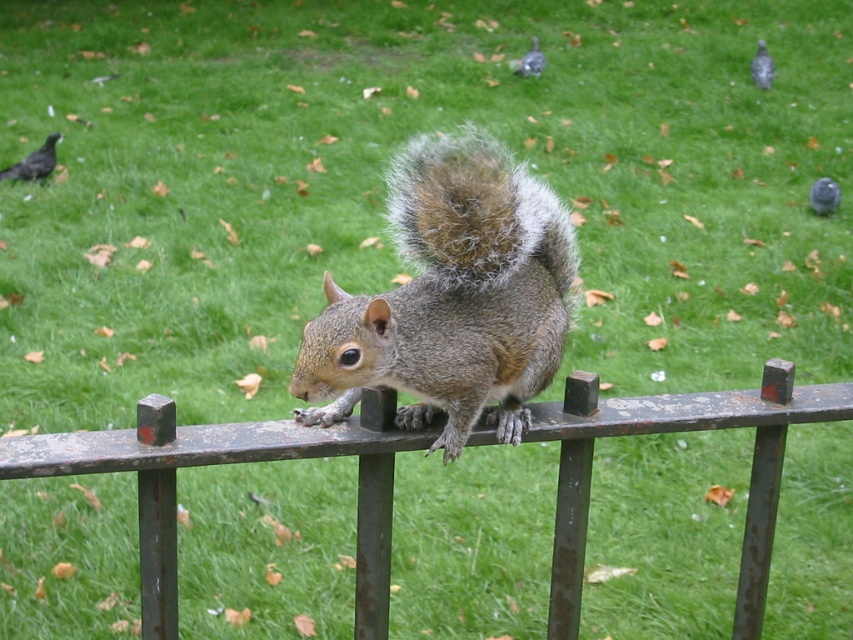
Can you confirm if shiny black bird at upper left is positioned above gray matte bird at upper center?

Incorrect, shiny black bird at upper left is not positioned above gray matte bird at upper center.

Who is taller, shiny black bird at upper left or gray matte bird at upper center?

Standing taller between the two is gray matte bird at upper center.

This screenshot has width=853, height=640. In order to click on shiny black bird at upper left in this screenshot , I will do `click(33, 163)`.

Is gray furry squirrel at center positioned in front of shiny black bird at upper left?

Yes, it is.

Between gray furry squirrel at center and shiny black bird at upper left, which one appears on the right side from the viewer's perspective?

Positioned to the right is gray furry squirrel at center.

Which is behind, point (454, 305) or point (33, 157)?

The point (33, 157) is behind.

This screenshot has height=640, width=853. In order to click on gray furry squirrel at center in this screenshot , I will do (451, 298).

Does matte gray pigeon at upper right have a greater width compared to gray matte bird at upper center?

No.

Between matte gray pigeon at upper right and gray matte bird at upper center, which one is positioned lower?

matte gray pigeon at upper right is below.

Where is `matte gray pigeon at upper right`? This screenshot has height=640, width=853. matte gray pigeon at upper right is located at coordinates (824, 196).